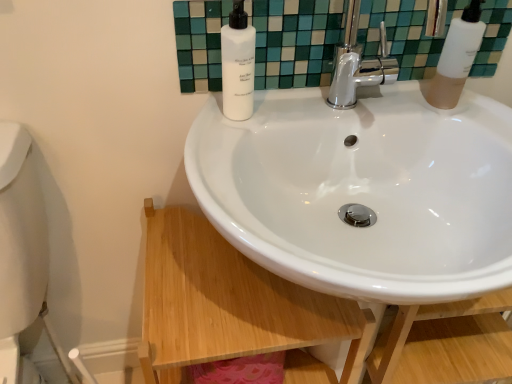
Where is `vacant space in front of white matte bottle at upper center, which ranks as the second soap dispenser in right-to-left order`? This screenshot has height=384, width=512. vacant space in front of white matte bottle at upper center, which ranks as the second soap dispenser in right-to-left order is located at coordinates (228, 159).